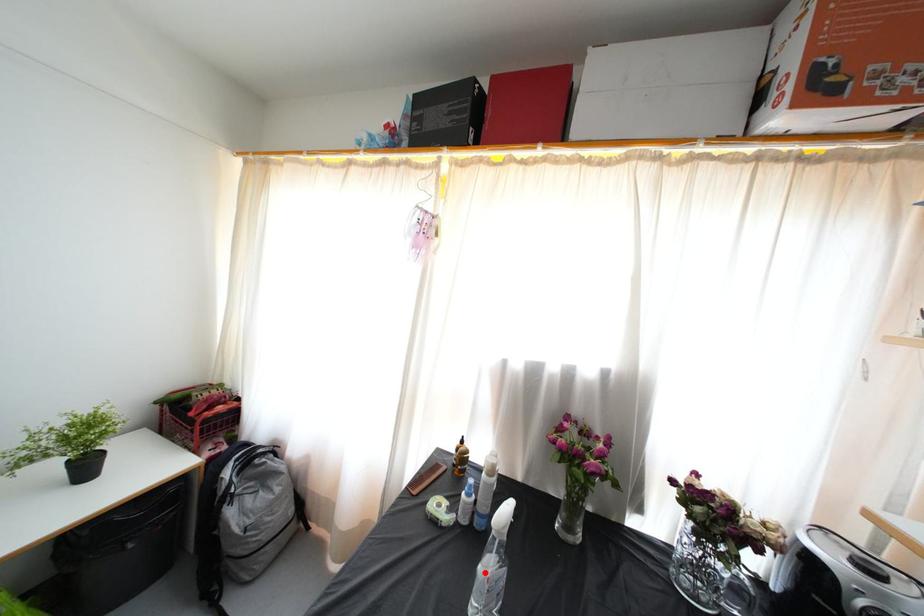
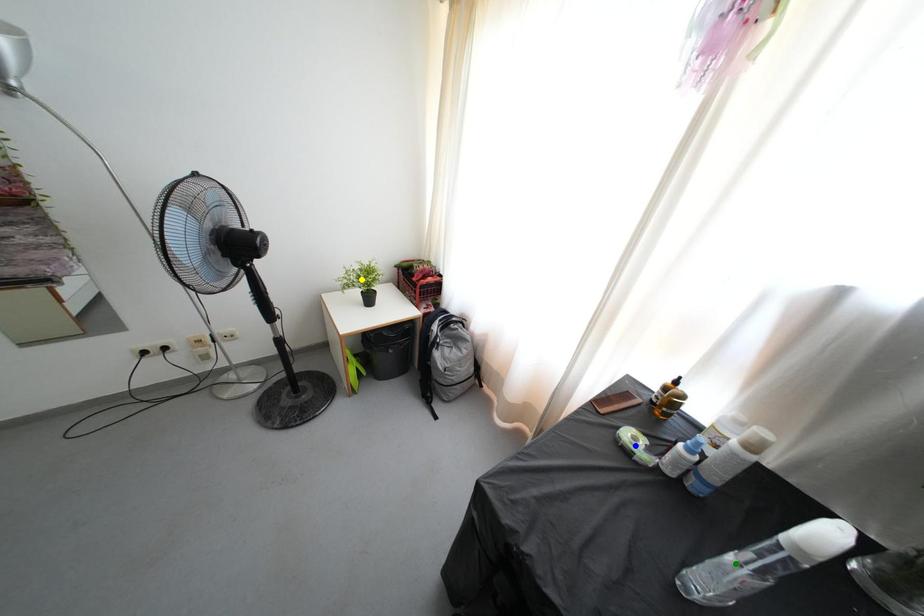
Question: I am providing you with two images of the same scene from different viewpoints. A red point is marked on the first image. You are given multiple points on the second image. Which point in image 2 is actually the same real-world point as the red point in image 1?

Choices:
 (A) green point
 (B) yellow point
 (C) blue point

Answer: (A)